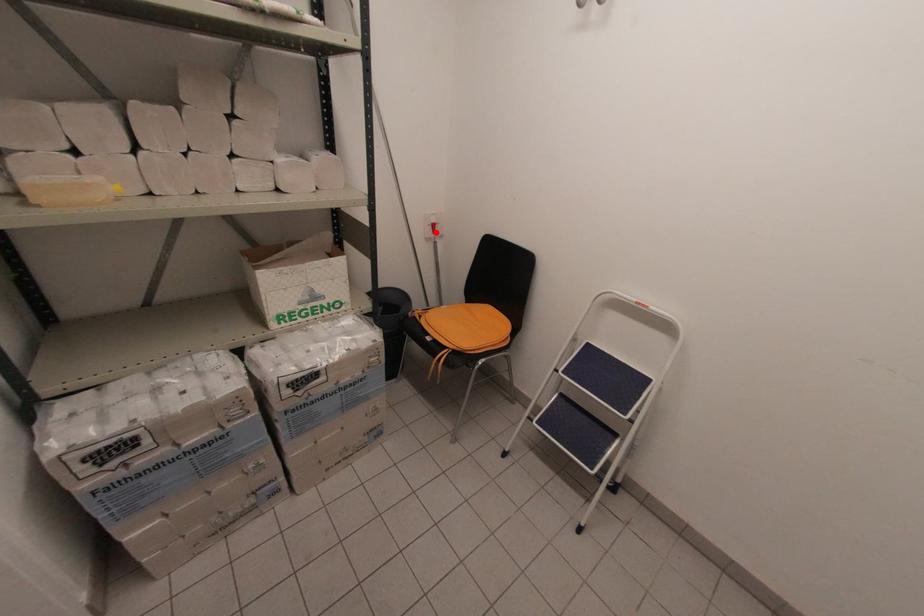
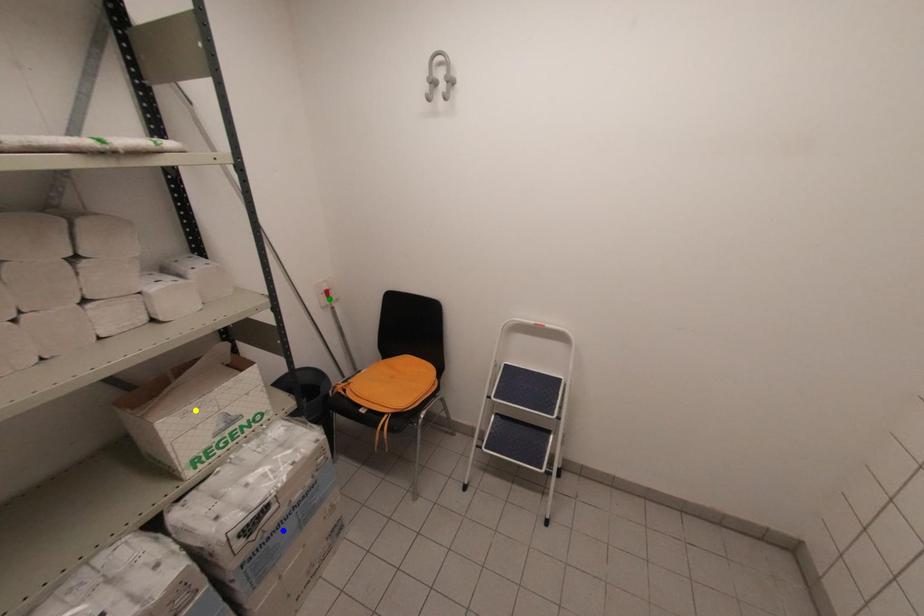
Question: I am providing you with two images of the same scene from different viewpoints. A red point is marked on the first image. You are given multiple points on the second image. Which point in image 2 represents the same 3d spot as the red point in image 1?

Choices:
 (A) blue point
 (B) yellow point
 (C) green point

Answer: (C)